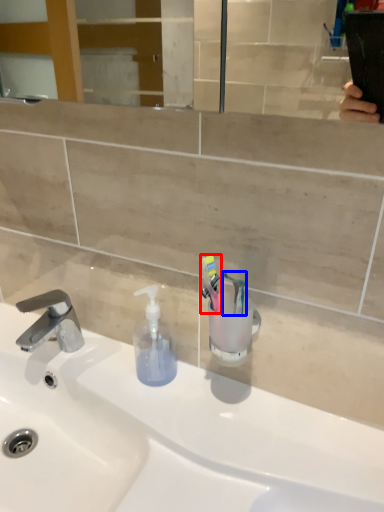
Question: Among these objects, which one is nearest to the camera, toothbrush (highlighted by a red box) or toothbrush (highlighted by a blue box)?

Choices:
 (A) toothbrush
 (B) toothbrush

Answer: (A)